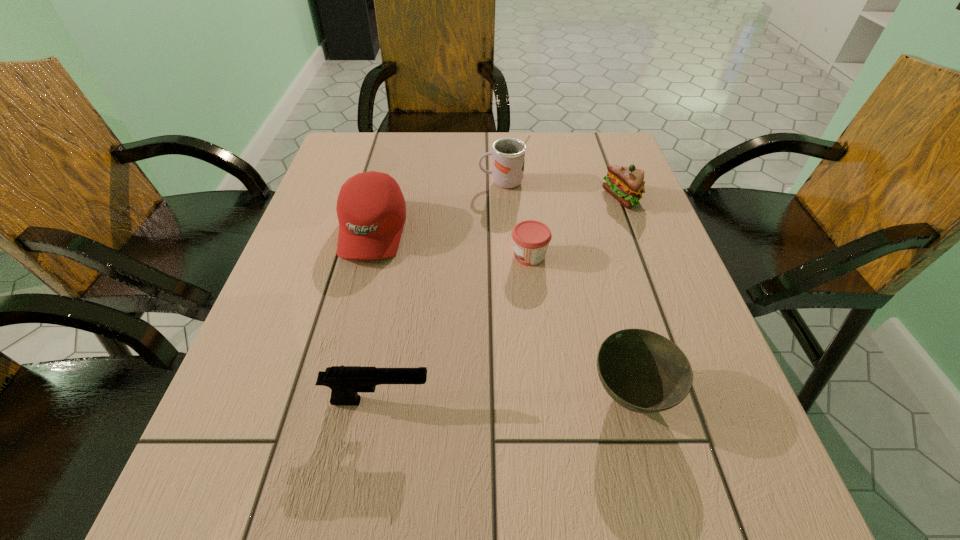
Where is `the tallest object`? The width and height of the screenshot is (960, 540). the tallest object is located at coordinates (508, 162).

You are a GUI agent. You are given a task and a screenshot of the screen. Output one action in this format:
    pyautogui.click(x=<x>, y=<y>)
    Task: Click on the cap
    
    Given the screenshot: What is the action you would take?
    pyautogui.click(x=371, y=210)

Locate an element on the screen. The image size is (960, 540). sandwich is located at coordinates (626, 184).

Identify the location of pistol. (345, 382).

The image size is (960, 540). I want to click on bowl, so click(x=643, y=371).

This screenshot has width=960, height=540. I want to click on the shortest object, so click(x=531, y=238).

Find the location of a particular element. free space located 0.110m on the side with the handle of the cup is located at coordinates (435, 183).

This screenshot has height=540, width=960. In order to click on vacant space located on the side with the handle of the cup in this screenshot , I will do `click(342, 183)`.

Locate an element on the screen. Image resolution: width=960 pixels, height=540 pixels. vacant space located on the side with the handle of the cup is located at coordinates (372, 183).

This screenshot has height=540, width=960. I want to click on vacant space situated on the front-facing side of the cap, so click(322, 429).